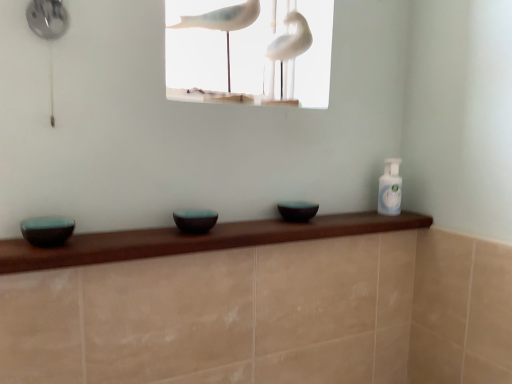
Question: Is white matte birds at upper center inside matte black bowl at center, positioned as the 3th basin in left-to-right order?

Choices:
 (A) no
 (B) yes

Answer: (A)

Question: Is the depth of matte black bowl at center, positioned as the 3th basin in left-to-right order, greater than that of white matte birds at upper center?

Choices:
 (A) no
 (B) yes

Answer: (B)

Question: Are matte black bowl at center, positioned as the 3th basin in left-to-right order, and white matte birds at upper center located far from each other?

Choices:
 (A) no
 (B) yes

Answer: (A)

Question: Considering the relative sizes of matte black bowl at center, positioned as the 3th basin in left-to-right order, and white matte birds at upper center in the image provided, is matte black bowl at center, positioned as the 3th basin in left-to-right order, thinner than white matte birds at upper center?

Choices:
 (A) no
 (B) yes

Answer: (B)

Question: Considering the relative sizes of matte black bowl at center, placed as the first basin when sorted from back to front, and white matte birds at upper center in the image provided, is matte black bowl at center, placed as the first basin when sorted from back to front, shorter than white matte birds at upper center?

Choices:
 (A) yes
 (B) no

Answer: (A)

Question: Can you confirm if matte black bowl at center, positioned as the 3th basin in left-to-right order, is positioned to the right of white matte birds at upper center?

Choices:
 (A) no
 (B) yes

Answer: (B)

Question: From the image's perspective, would you say teal glossy bowl at left, which is the third basin from right to left, is positioned over matte black bowl at center, which appears as the 2th basin when viewed from the back?

Choices:
 (A) no
 (B) yes

Answer: (A)

Question: Is teal glossy bowl at left, which is the third basin in back-to-front order, bigger than matte black bowl at center, the second basin positioned from the front?

Choices:
 (A) no
 (B) yes

Answer: (A)

Question: Does teal glossy bowl at left, which is the third basin from right to left, have a lesser height compared to matte black bowl at center, which appears as the 2th basin when viewed from the back?

Choices:
 (A) no
 (B) yes

Answer: (B)

Question: Considering the relative sizes of teal glossy bowl at left, acting as the 1th basin starting from the left, and matte black bowl at center, the 2th basin viewed from the right, in the image provided, is teal glossy bowl at left, acting as the 1th basin starting from the left, taller than matte black bowl at center, the 2th basin viewed from the right,?

Choices:
 (A) no
 (B) yes

Answer: (A)

Question: From the image's perspective, does teal glossy bowl at left, which is the third basin in back-to-front order, appear lower than matte black bowl at center, which is counted as the 2th basin, starting from the left?

Choices:
 (A) yes
 (B) no

Answer: (A)

Question: Does teal glossy bowl at left, which is counted as the 1th basin, starting from the front, contain matte black bowl at center, which is counted as the 2th basin, starting from the left?

Choices:
 (A) no
 (B) yes

Answer: (A)

Question: Is the position of matte black bowl at center, the 2th basin viewed from the right, less distant than that of white glossy bird at upper center?

Choices:
 (A) yes
 (B) no

Answer: (A)